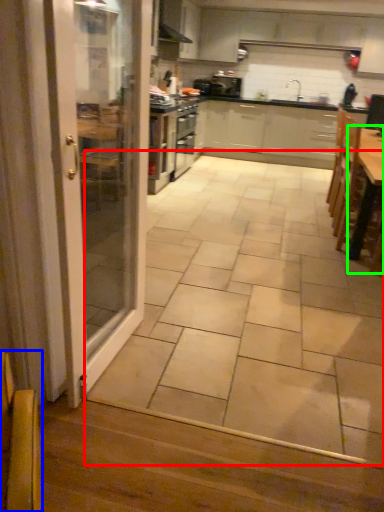
Question: Considering the real-world distances, which object is closest to ceramic tile (highlighted by a red box)? armchair (highlighted by a blue box) or table (highlighted by a green box).

Choices:
 (A) armchair
 (B) table

Answer: (B)